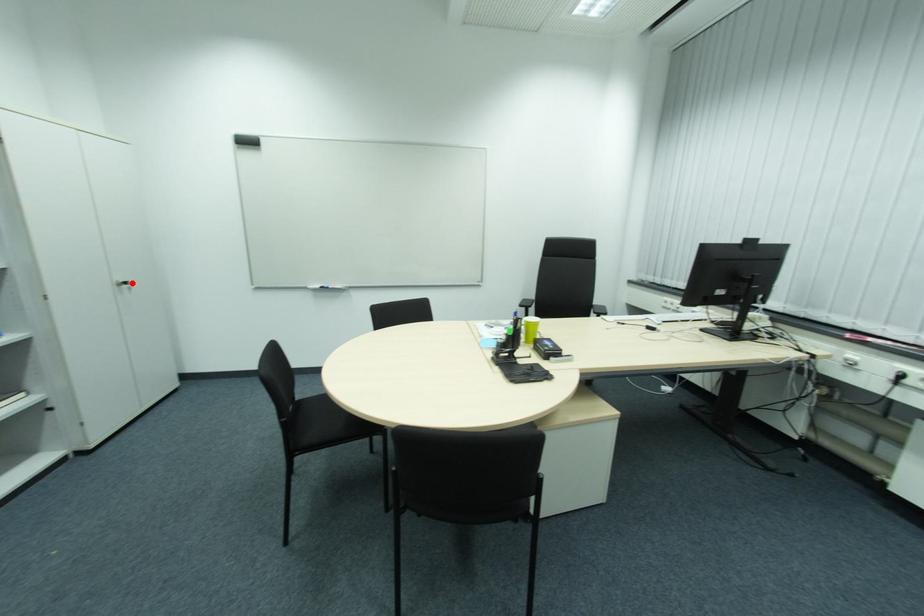
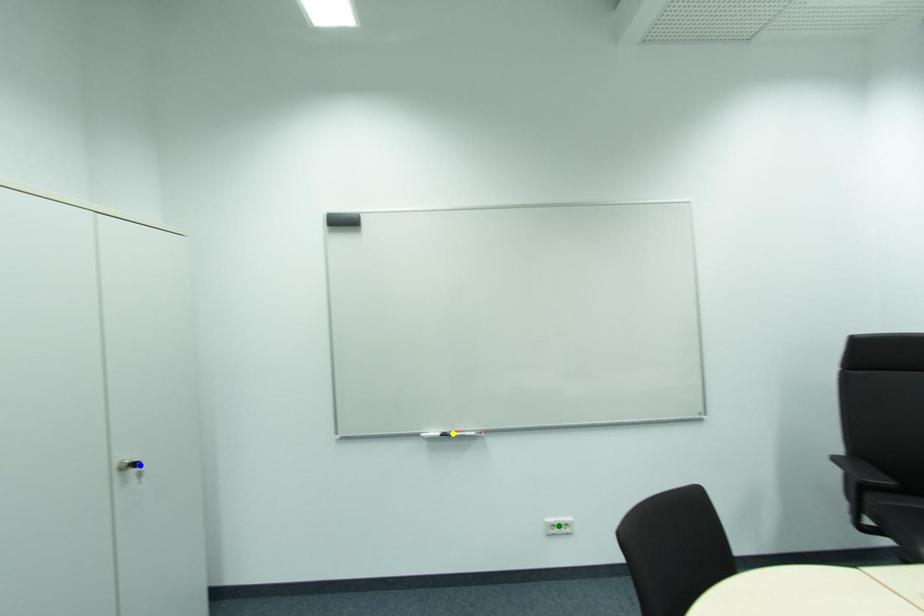
Question: I am providing you with two images of the same scene from different viewpoints. A red point is marked on the first image. You are given multiple points on the second image. Which point in image 2 is actually the same real-world point as the red point in image 1?

Choices:
 (A) green point
 (B) yellow point
 (C) blue point

Answer: (C)